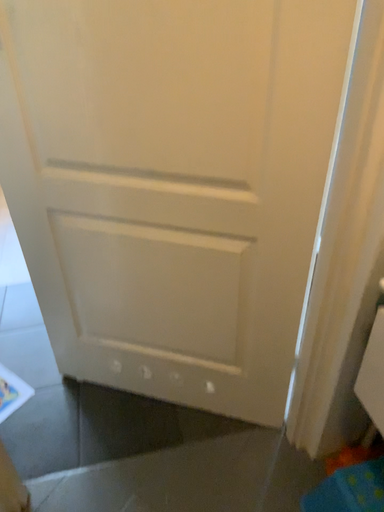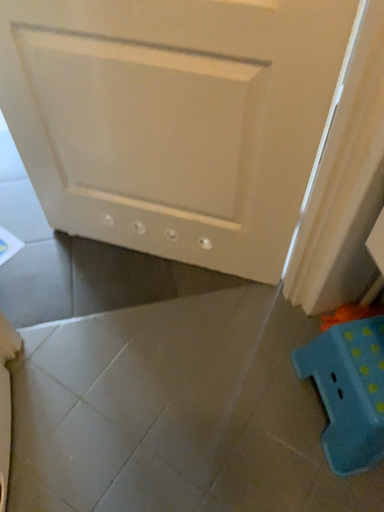
Question: Which way did the camera rotate in the video?

Choices:
 (A) rotated upward
 (B) rotated downward

Answer: (B)